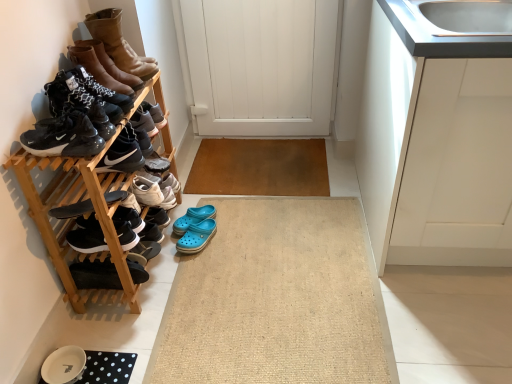
I want to click on free space on the front side of blue rubber clogs at center, which is the second footwear in bottom-to-top order, so click(x=206, y=261).